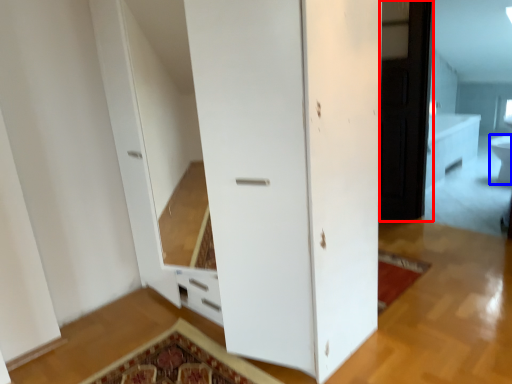
Question: Which point is further to the camera, screen door (highlighted by a red box) or toilet bowl (highlighted by a blue box)?

Choices:
 (A) screen door
 (B) toilet bowl

Answer: (B)